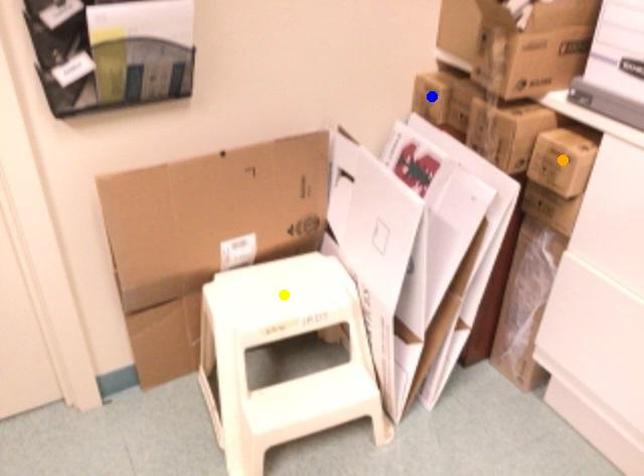
Order these from nearest to farthest:
blue point, orange point, yellow point

orange point → yellow point → blue point